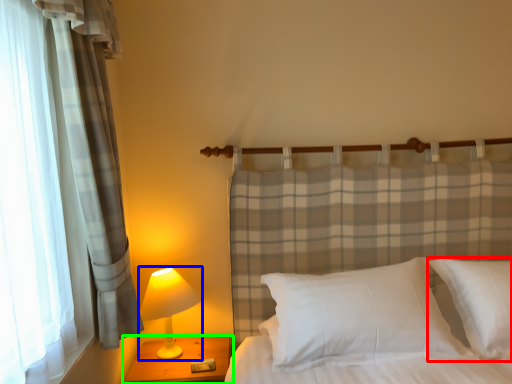
Question: Based on their relative distances, which object is nearer to pillow (highlighted by a red box)? Choose from lamp (highlighted by a blue box) and nightstand (highlighted by a green box).

Choices:
 (A) lamp
 (B) nightstand

Answer: (B)